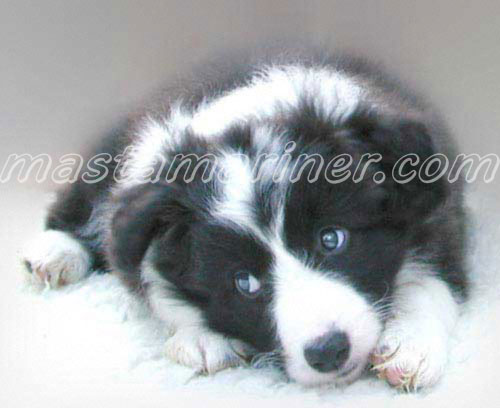
Identify the location of soft white surface. The image size is (500, 408). click(x=86, y=363).